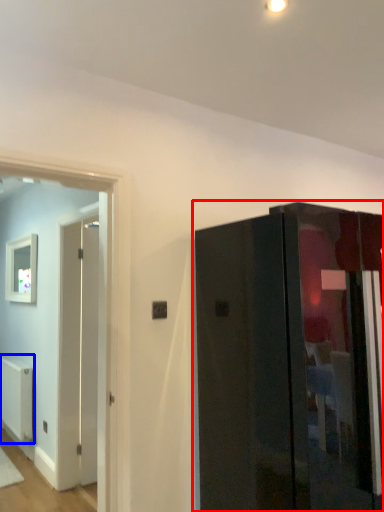
Question: Among these objects, which one is nearest to the camera, door (highlighted by a red box) or radiator (highlighted by a blue box)?

Choices:
 (A) door
 (B) radiator

Answer: (A)